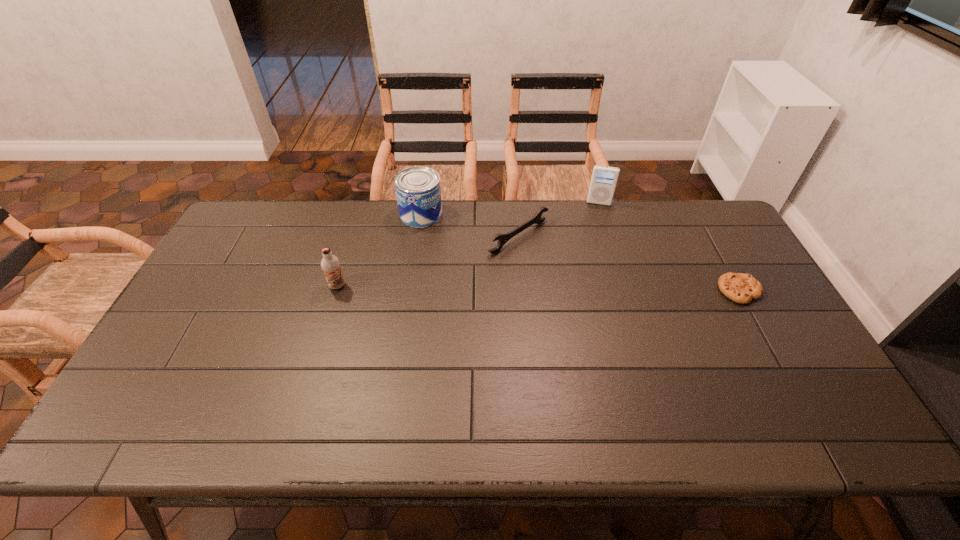
Identify the location of the leftmost object. (330, 264).

Identify the location of the shortest object. The image size is (960, 540). (741, 288).

Locate an element on the screen. cookie is located at coordinates (741, 288).

Find the location of a particular element. wrench is located at coordinates (536, 219).

This screenshot has height=540, width=960. In order to click on the fourth tallest object in this screenshot , I will do `click(536, 219)`.

This screenshot has width=960, height=540. I want to click on the second object from left to right, so click(418, 192).

At what (x,y) coordinates should I click in order to perform the action: click on the second object from right to left. Please return your answer as a coordinate pair (x, y). Image resolution: width=960 pixels, height=540 pixels. Looking at the image, I should click on (603, 182).

Where is `vacant region located 0.070m on the right of the leftmost object`? vacant region located 0.070m on the right of the leftmost object is located at coordinates (371, 286).

At what (x,y) coordinates should I click in order to perform the action: click on vacant space located 0.160m on the front of the cookie. Please return your answer as a coordinate pair (x, y). Image resolution: width=960 pixels, height=540 pixels. Looking at the image, I should click on (774, 354).

At what (x,y) coordinates should I click in order to perform the action: click on vacant area situated 0.190m on the open ends of the third object from right to left. Please return your answer as a coordinate pair (x, y). The width and height of the screenshot is (960, 540). Looking at the image, I should click on (590, 284).